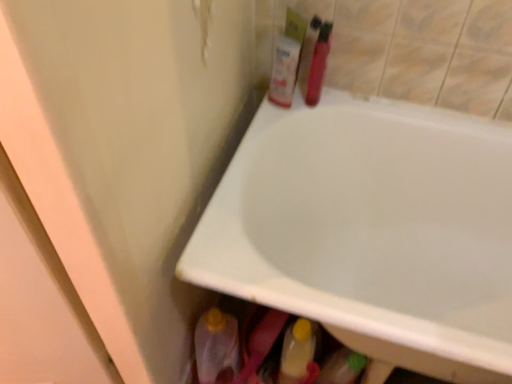
Question: Is shiny plastic bottle at upper right, placed as the second toiletry when sorted from left to right, shorter than translucent plastic bottle at upper center, which is the 2th toiletry from right to left?

Choices:
 (A) yes
 (B) no

Answer: (A)

Question: Could you tell me if shiny plastic bottle at upper right, which ranks as the 1th toiletry in right-to-left order, is facing translucent plastic bottle at upper center, positioned as the first toiletry in left-to-right order?

Choices:
 (A) no
 (B) yes

Answer: (B)

Question: Considering the relative sizes of shiny plastic bottle at upper right, which ranks as the 1th toiletry in right-to-left order, and translucent plastic bottle at upper center, positioned as the first toiletry in left-to-right order, in the image provided, is shiny plastic bottle at upper right, which ranks as the 1th toiletry in right-to-left order, smaller than translucent plastic bottle at upper center, positioned as the first toiletry in left-to-right order,?

Choices:
 (A) no
 (B) yes

Answer: (A)

Question: Does shiny plastic bottle at upper right, placed as the second toiletry when sorted from left to right, lie behind translucent plastic bottle at upper center, positioned as the first toiletry in left-to-right order?

Choices:
 (A) no
 (B) yes

Answer: (A)

Question: From the image's perspective, is shiny plastic bottle at upper right, placed as the second toiletry when sorted from left to right, on translucent plastic bottle at upper center, which is the 2th toiletry from right to left?

Choices:
 (A) yes
 (B) no

Answer: (B)

Question: Is shiny plastic bottle at upper right, which ranks as the 1th toiletry in right-to-left order, next to translucent plastic bottle at upper center, positioned as the first toiletry in left-to-right order, and touching it?

Choices:
 (A) yes
 (B) no

Answer: (A)

Question: Does yellow cap plastic bottle at lower center have a greater width compared to white glossy bathtub at upper center?

Choices:
 (A) yes
 (B) no

Answer: (B)

Question: Is yellow cap plastic bottle at lower center smaller than white glossy bathtub at upper center?

Choices:
 (A) yes
 (B) no

Answer: (A)

Question: Considering the relative sizes of yellow cap plastic bottle at lower center and white glossy bathtub at upper center in the image provided, is yellow cap plastic bottle at lower center thinner than white glossy bathtub at upper center?

Choices:
 (A) yes
 (B) no

Answer: (A)

Question: From a real-world perspective, is yellow cap plastic bottle at lower center on top of white glossy bathtub at upper center?

Choices:
 (A) no
 (B) yes

Answer: (A)

Question: From the image's perspective, is yellow cap plastic bottle at lower center below white glossy bathtub at upper center?

Choices:
 (A) no
 (B) yes

Answer: (B)

Question: Would you say white glossy bathtub at upper center is part of yellow cap plastic bottle at lower center's contents?

Choices:
 (A) yes
 (B) no

Answer: (B)

Question: Does white glossy bathtub at upper center lie behind yellow cap plastic bottle at lower center?

Choices:
 (A) yes
 (B) no

Answer: (B)